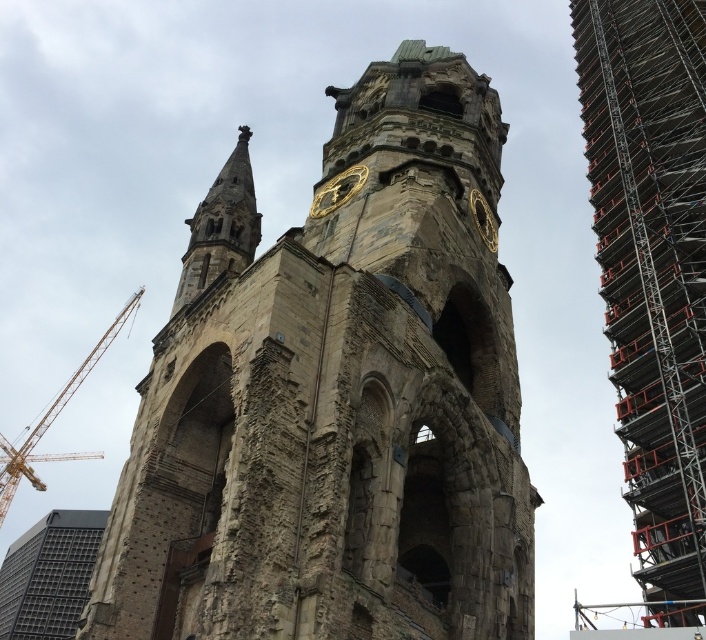
Is stone tower at center wider than gold metallic clock at upper center?

Indeed, stone tower at center has a greater width compared to gold metallic clock at upper center.

Which is more to the left, stone tower at center or gold metallic clock at upper center?

gold metallic clock at upper center

Does point (179, 566) come farther from viewer compared to point (316, 216)?

No, it is not.

You are a GUI agent. You are given a task and a screenshot of the screen. Output one action in this format:
    pyautogui.click(x=<x>, y=<y>)
    Task: Click on the stone tower at center
    This screenshot has height=640, width=706.
    Given the screenshot: What is the action you would take?
    pyautogui.click(x=335, y=397)

Which is above, yellow metal crane at upper left or gold metallic clock at upper center?

gold metallic clock at upper center is higher up.

Locate an element on the screen. yellow metal crane at upper left is located at coordinates (52, 416).

Locate an element on the screen. The width and height of the screenshot is (706, 640). yellow metal crane at upper left is located at coordinates (52, 416).

Can you confirm if stone tower at center is positioned above metallic scaffolding at right?

Actually, stone tower at center is below metallic scaffolding at right.

Is point (402, 333) positioned after point (690, 481)?

No, it is in front of (690, 481).

Who is more forward, (347, 220) or (614, 252)?

Positioned in front is point (347, 220).

Where is `stone tower at center`? The image size is (706, 640). stone tower at center is located at coordinates (335, 397).